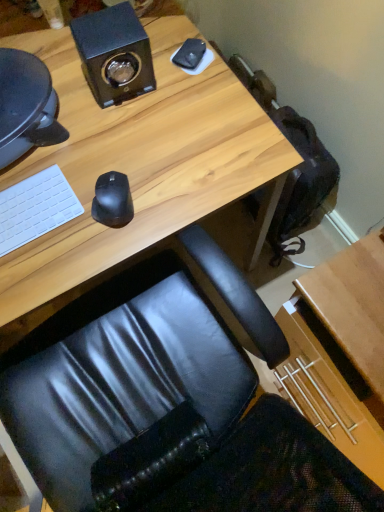
Identify the location of vacant area that is in front of black matte mouse at center. The height and width of the screenshot is (512, 384). (95, 254).